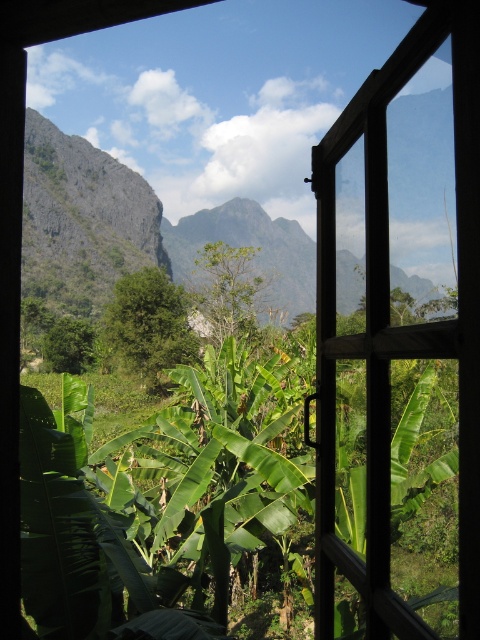
You are standing outside and looking through the wooden frame at center to see the green leafy banana tree at center. Can you see the entire tree through the frame?

The wooden frame at center is in front of the green leafy banana tree at center, so the tree is partially or fully blocked by the frame, making it impossible to see the entire tree through the frame.

You are an interior designer assessing the placement of a new painting. The wooden frame at center and the green leafy banana tree at center are both in the room. If the painting is 1.2 meters wide, can it fit between them without overlapping?

The wooden frame at center is narrower than the green leafy banana tree at center. However, since both objects are positioned at the center, there might not be enough space between them to accommodate the 1.2 meter wide painting without overlapping. Consider adjusting their positions or choosing a smaller artwork.